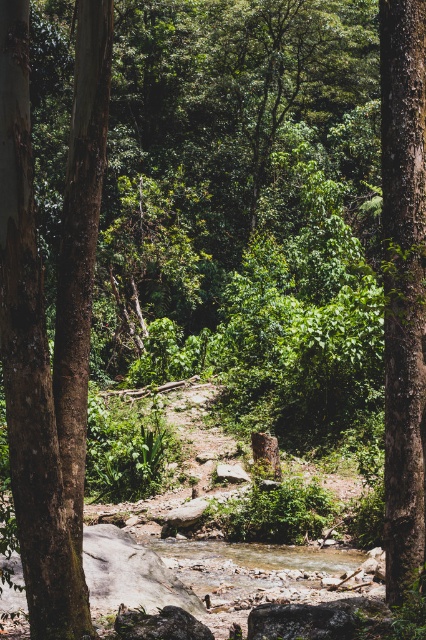
Question: Is brown rough bark tree at left wider than smooth brown tree trunk at right?

Choices:
 (A) yes
 (B) no

Answer: (A)

Question: Can you confirm if brown rough bark tree at left is positioned above smooth brown tree trunk at right?

Choices:
 (A) yes
 (B) no

Answer: (B)

Question: Which point is farther to the camera?

Choices:
 (A) (32, 584)
 (B) (416, 189)

Answer: (B)

Question: Which object appears farthest from the camera in this image?

Choices:
 (A) brown rough bark tree at left
 (B) smooth brown tree trunk at right

Answer: (B)

Question: Is brown rough bark tree at left behind smooth brown tree trunk at right?

Choices:
 (A) no
 (B) yes

Answer: (A)